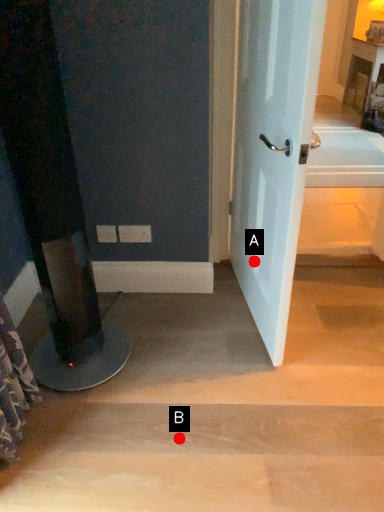
Question: Two points are circled on the image, labeled by A and B beside each circle. Among these points, which one is farthest from the camera?

Choices:
 (A) A is further
 (B) B is further

Answer: (A)